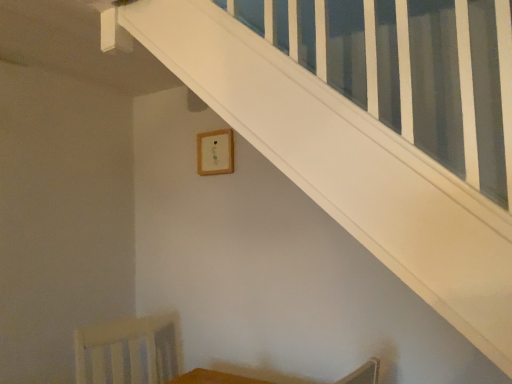
Question: Considering the relative sizes of wooden frame at upper center and white wood swivel chair at lower left in the image provided, is wooden frame at upper center thinner than white wood swivel chair at lower left?

Choices:
 (A) no
 (B) yes

Answer: (B)

Question: Can you confirm if wooden frame at upper center is shorter than white wood swivel chair at lower left?

Choices:
 (A) no
 (B) yes

Answer: (B)

Question: Does wooden frame at upper center lie in front of white wood swivel chair at lower left?

Choices:
 (A) no
 (B) yes

Answer: (A)

Question: Is wooden frame at upper center at the left side of white wood swivel chair at lower left?

Choices:
 (A) no
 (B) yes

Answer: (A)

Question: Does wooden frame at upper center have a greater width compared to white wood swivel chair at lower left?

Choices:
 (A) no
 (B) yes

Answer: (A)

Question: Can you confirm if wooden frame at upper center is bigger than white wood swivel chair at lower left?

Choices:
 (A) no
 (B) yes

Answer: (A)

Question: Considering the relative sizes of wooden table at lower center and white wood swivel chair at lower left in the image provided, is wooden table at lower center shorter than white wood swivel chair at lower left?

Choices:
 (A) yes
 (B) no

Answer: (A)

Question: Can you confirm if wooden table at lower center is positioned to the left of white wood swivel chair at lower left?

Choices:
 (A) yes
 (B) no

Answer: (B)

Question: Is white wood swivel chair at lower left completely or partially inside wooden table at lower center?

Choices:
 (A) yes
 (B) no

Answer: (B)

Question: Is wooden table at lower center positioned in front of white wood swivel chair at lower left?

Choices:
 (A) yes
 (B) no

Answer: (A)

Question: From a real-world perspective, is wooden table at lower center positioned under white wood swivel chair at lower left based on gravity?

Choices:
 (A) no
 (B) yes

Answer: (A)

Question: From the image's perspective, is wooden table at lower center located above white wood swivel chair at lower left?

Choices:
 (A) no
 (B) yes

Answer: (B)

Question: Does white wood swivel chair at lower left lie in front of wooden table at lower center?

Choices:
 (A) yes
 (B) no

Answer: (B)